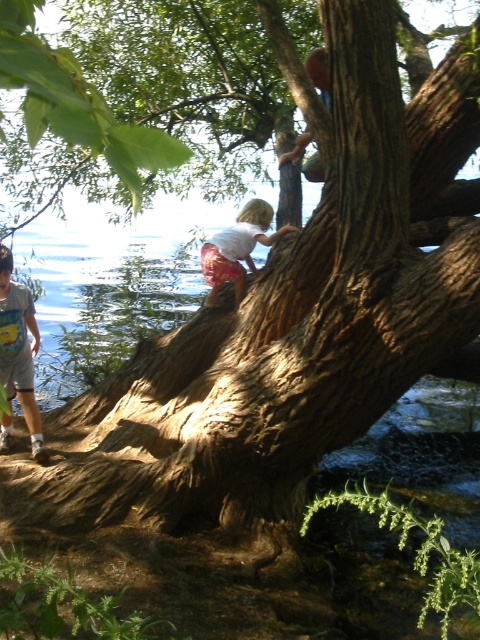
Question: Among these points, which one is nearest to the camera?

Choices:
 (A) (10, 324)
 (B) (229, 248)

Answer: (A)

Question: Which of the following is the closest to the observer?

Choices:
 (A) (226, 228)
 (B) (2, 262)

Answer: (B)

Question: Does light blue t-shirt at lower left have a greater width compared to white cotton shirt at upper center?

Choices:
 (A) no
 (B) yes

Answer: (A)

Question: In this image, where is light blue t-shirt at lower left located relative to white cotton shirt at upper center?

Choices:
 (A) right
 (B) left

Answer: (B)

Question: Can you confirm if light blue t-shirt at lower left is bigger than white cotton shirt at upper center?

Choices:
 (A) yes
 (B) no

Answer: (A)